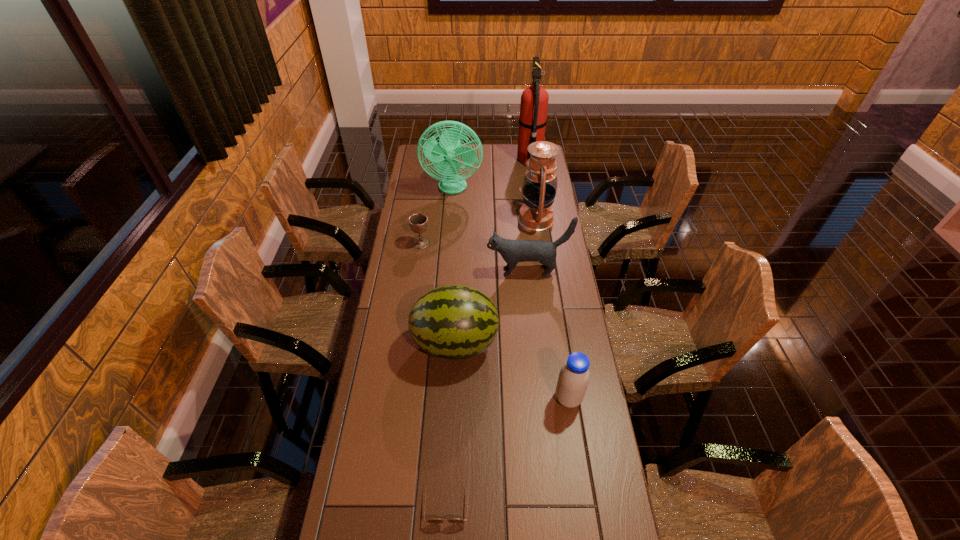
The width and height of the screenshot is (960, 540). Find the location of `the farthest object`. the farthest object is located at coordinates (534, 100).

I want to click on fire extinguisher, so click(534, 100).

Where is `fan`? Image resolution: width=960 pixels, height=540 pixels. fan is located at coordinates (441, 154).

This screenshot has width=960, height=540. I want to click on oil lamp, so click(539, 188).

Where is `the fourth nearest object`? the fourth nearest object is located at coordinates (512, 251).

In order to click on watermelon in this screenshot , I will do `click(454, 322)`.

Identify the location of soya milk. The height and width of the screenshot is (540, 960). (573, 380).

You are a GUI agent. You are given a task and a screenshot of the screen. Output one action in this format:
    pyautogui.click(x=<x>, y=<y>)
    Task: Click on the second shortest object
    The height and width of the screenshot is (540, 960).
    Given the screenshot: What is the action you would take?
    pyautogui.click(x=418, y=222)

Find the location of a particular element. This screenshot has width=960, height=540. chalice is located at coordinates (418, 222).

In order to click on the nearest object in this screenshot , I will do `click(433, 520)`.